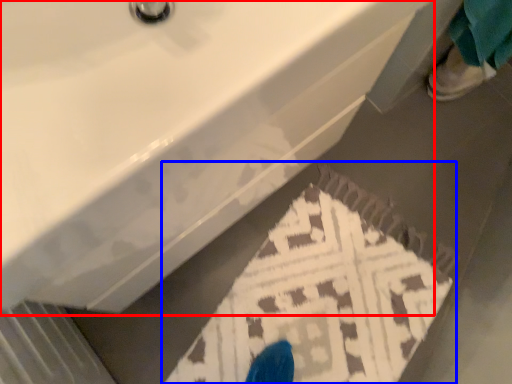
Question: Which of the following is the farthest to the observer, sink (highlighted by a red box) or doormat (highlighted by a blue box)?

Choices:
 (A) sink
 (B) doormat

Answer: (B)